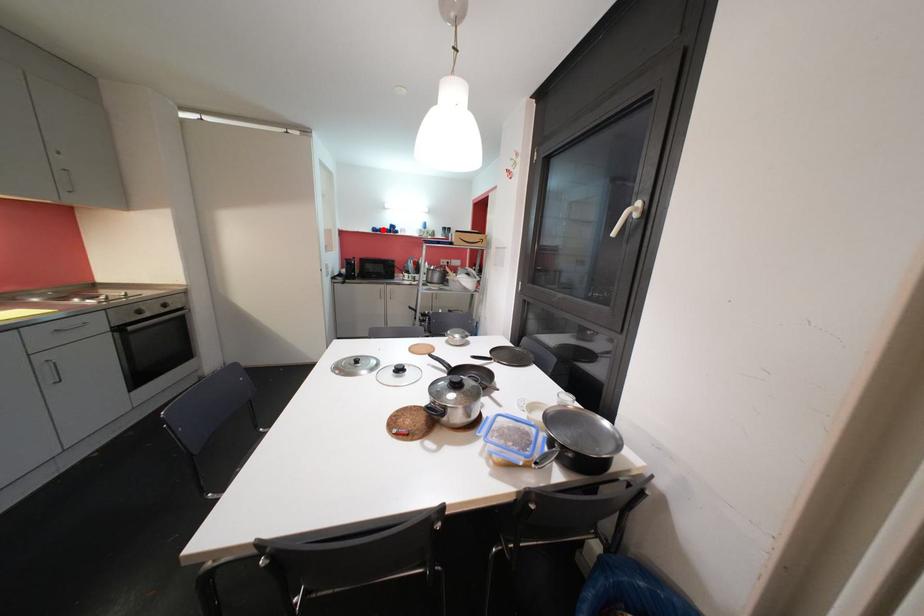
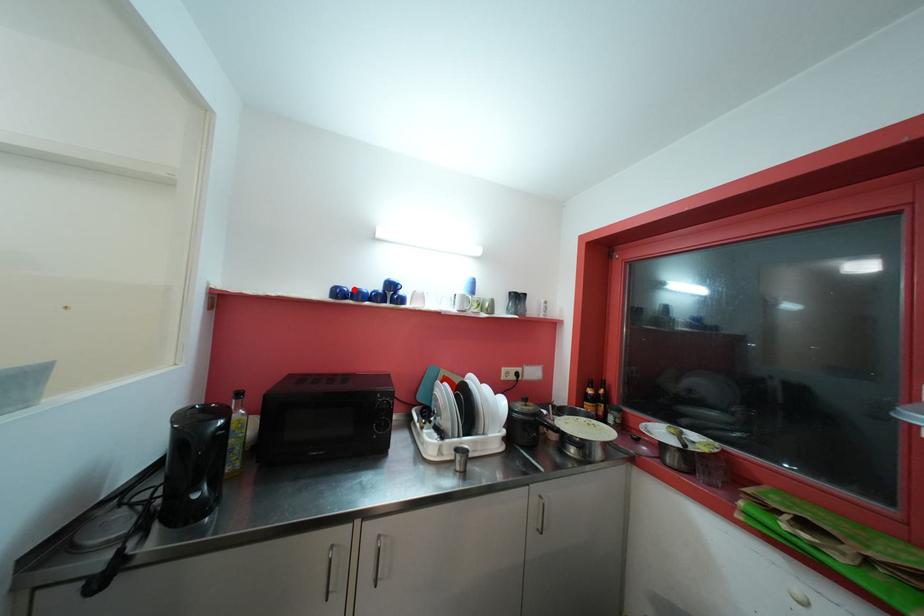
I am providing you with two images of the same scene from different viewpoints. A red point is marked on the first image and another point is marked on the second image. Do the highlighted points in image1 and image2 indicate the same real-world spot?

Yes